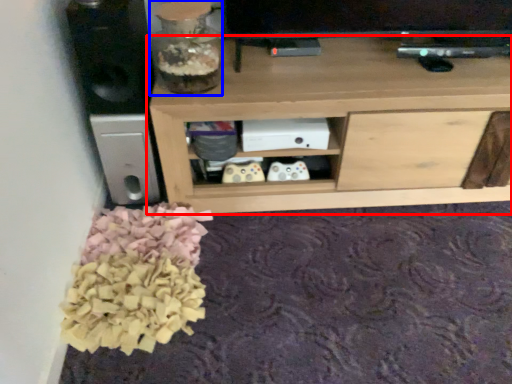
Question: Among these objects, which one is farthest to the camera, shelf (highlighted by a red box) or glass vase (highlighted by a blue box)?

Choices:
 (A) shelf
 (B) glass vase

Answer: (A)